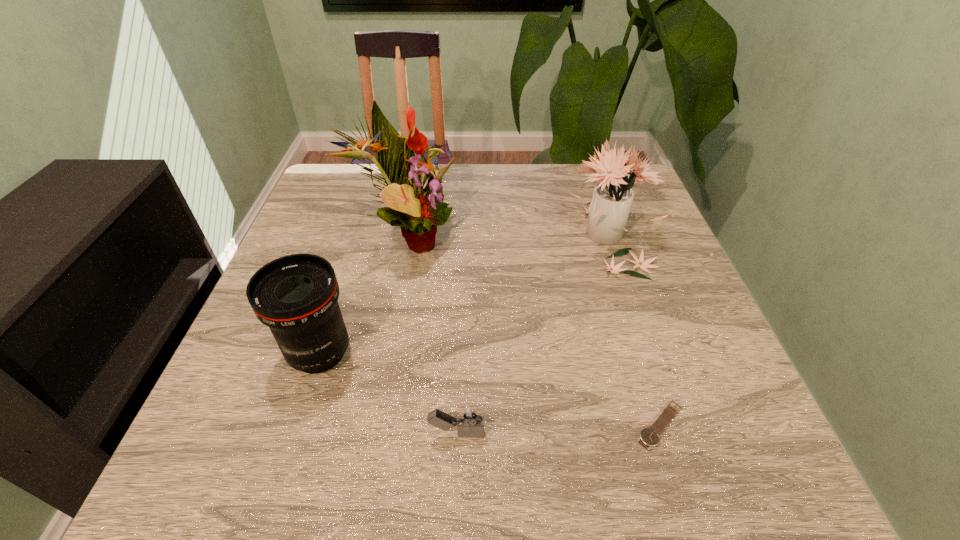
At what (x,y) coordinates should I click in order to perform the action: click on the taller bouquet. Please return your answer as a coordinate pair (x, y). The height and width of the screenshot is (540, 960). Looking at the image, I should click on (417, 211).

The width and height of the screenshot is (960, 540). In order to click on the tallest object in this screenshot , I will do `click(417, 211)`.

Where is `the shorter bouquet`? the shorter bouquet is located at coordinates (609, 209).

Locate an element on the screen. The width and height of the screenshot is (960, 540). the right bouquet is located at coordinates (609, 209).

At what (x,y) coordinates should I click in order to perform the action: click on the third tallest object. Please return your answer as a coordinate pair (x, y). This screenshot has width=960, height=540. Looking at the image, I should click on (296, 296).

At what (x,y) coordinates should I click in order to perform the action: click on telephoto lens. Please return your answer as a coordinate pair (x, y). This screenshot has height=540, width=960. Looking at the image, I should click on (296, 296).

The height and width of the screenshot is (540, 960). Find the location of `igniter`. igniter is located at coordinates (469, 420).

This screenshot has height=540, width=960. What are the coordinates of `watch` in the screenshot? It's located at (649, 437).

At what (x,y) coordinates should I click in order to perform the action: click on blank space located 0.140m on the front-facing side of the taller bouquet. Please return your answer as a coordinate pair (x, y). The image size is (960, 540). Looking at the image, I should click on (518, 240).

You are a GUI agent. You are given a task and a screenshot of the screen. Output one action in this format:
    pyautogui.click(x=<x>, y=<y>)
    Task: Click on the free point located 0.120m on the left of the second tallest object
    
    Given the screenshot: What is the action you would take?
    pyautogui.click(x=517, y=234)